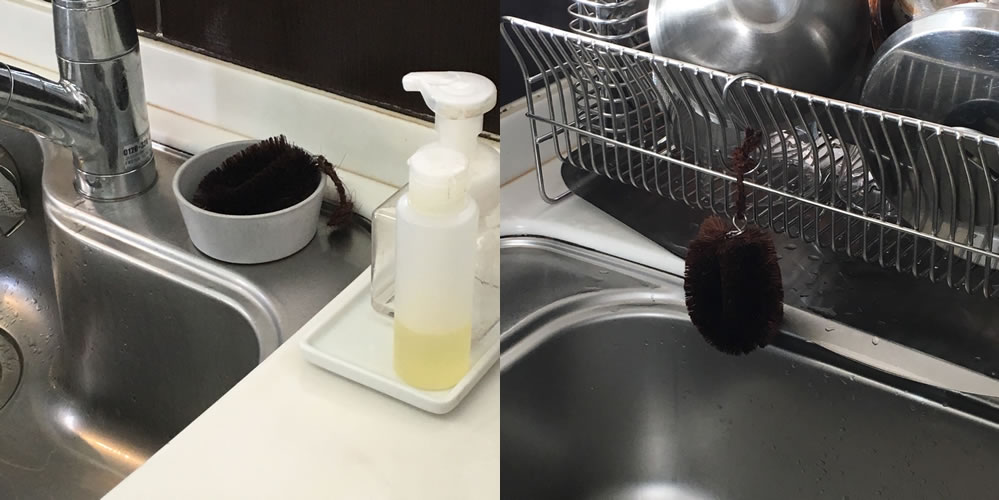
What are the coordinates of `drying rack` in the screenshot? It's located at (802, 201).